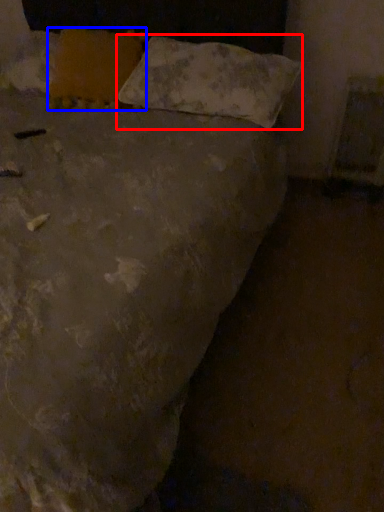
Question: Which object appears closest to the camera in this image, pillow (highlighted by a red box) or pillow (highlighted by a blue box)?

Choices:
 (A) pillow
 (B) pillow

Answer: (A)